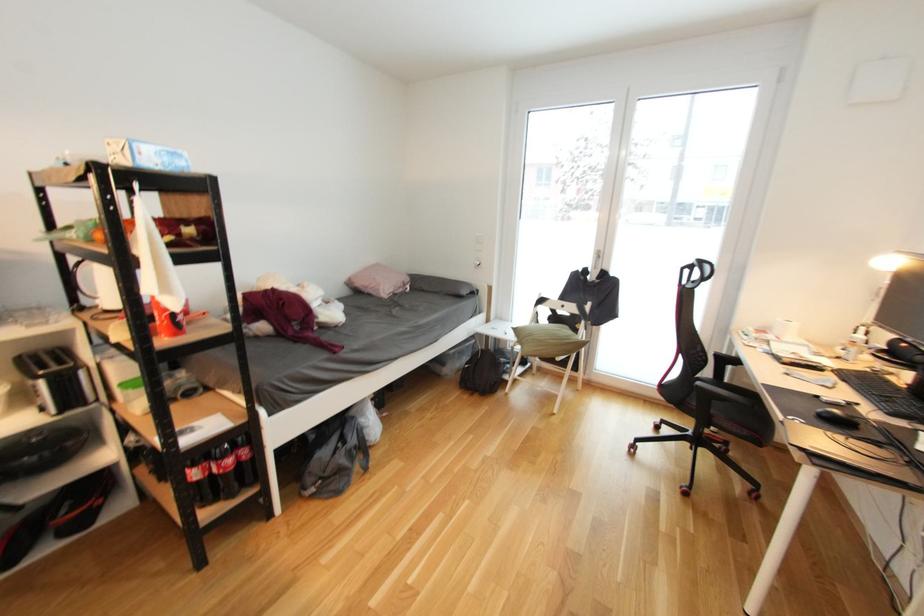
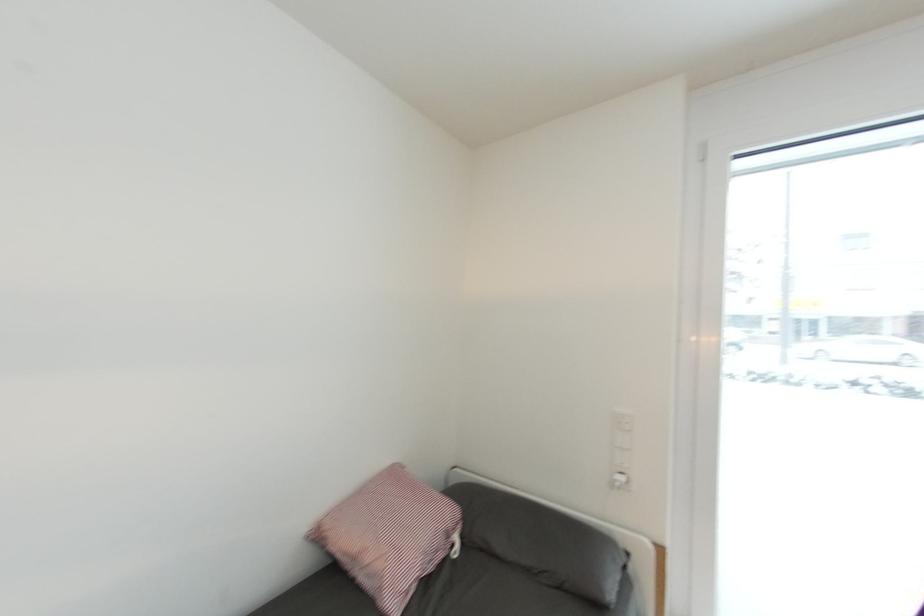
Question: The images are taken continuously from a first-person perspective. In which direction are you moving?

Choices:
 (A) Left
 (B) Right
 (C) Forward
 (D) Backward

Answer: (C)